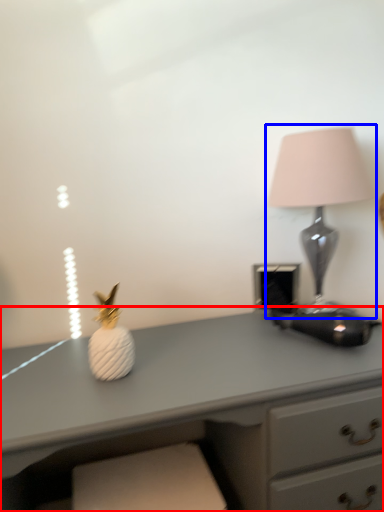
Question: Which point is further to the camera, desk (highlighted by a red box) or lamp (highlighted by a blue box)?

Choices:
 (A) desk
 (B) lamp

Answer: (B)